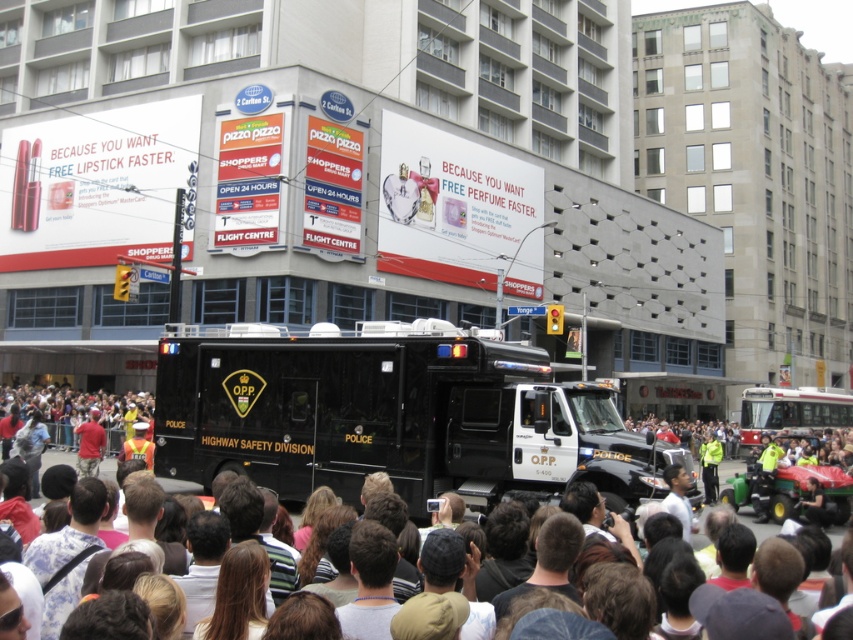
Question: Which point is farther from the camera taking this photo?

Choices:
 (A) (96, 456)
 (B) (515, 452)
 (C) (705, 481)

Answer: (C)

Question: Can you confirm if dark brown hair at center is smaller than yellow reflective vest at center?

Choices:
 (A) yes
 (B) no

Answer: (B)

Question: Which object is farther from the camera taking this photo?

Choices:
 (A) black matte truck at center
 (B) dark brown hair at center
 (C) red shirt at center

Answer: (C)

Question: Does black matte truck at center appear over dark brown hair at center?

Choices:
 (A) no
 (B) yes

Answer: (B)

Question: Which is nearer to the dark brown hair at center?

Choices:
 (A) yellow reflective vest at center
 (B) black matte truck at center

Answer: (B)

Question: Does black matte truck at center have a larger size compared to dark brown hair at center?

Choices:
 (A) yes
 (B) no

Answer: (B)